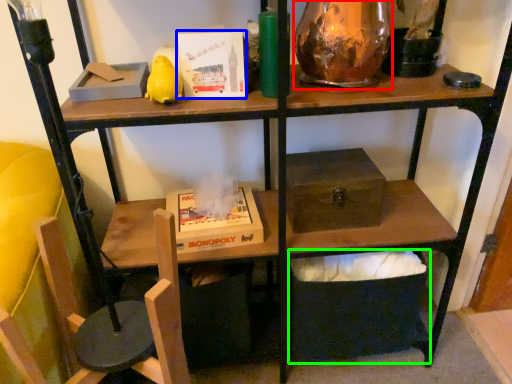
Question: Considering the real-world distances, which object is farthest from glass vase (highlighted by a red box)? paperback book (highlighted by a blue box) or box (highlighted by a green box)?

Choices:
 (A) paperback book
 (B) box

Answer: (B)